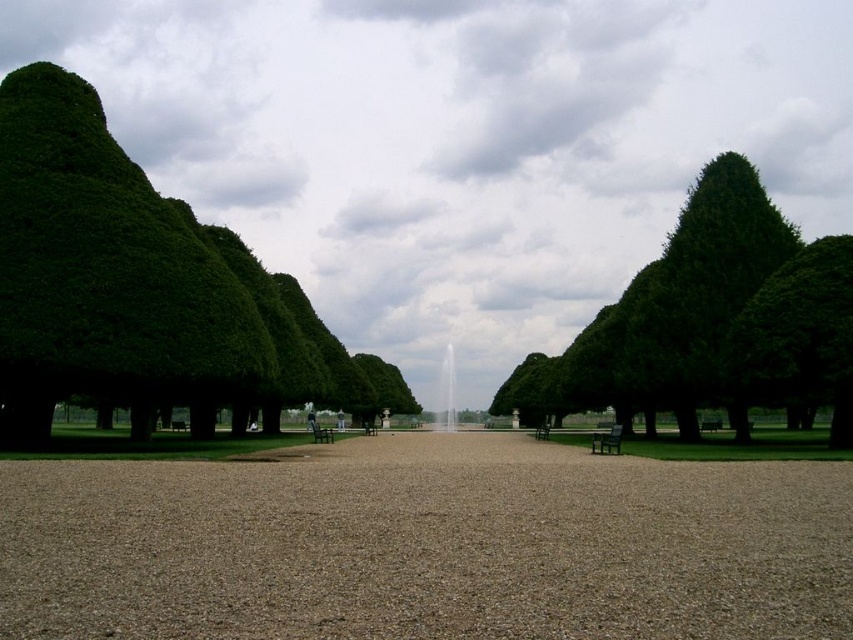
You are a gardener planning to trim both the green leafy tree at left and the green textured tree at right. Based on their sizes, which tree requires more time and effort to maintain?

The green leafy tree at left requires more time and effort to maintain because it is bigger than the green textured tree at right.

Based on the photo, you are standing at the starting point of the garden pathway and want to walk towards the fountain. Is the brown gravel at center located directly in front of you along the path?

The brown gravel at center is located at point coordinates that are slightly off the central path, so it is not directly in front along the path. Therefore, you would need to adjust your direction slightly to reach it.

You are standing at the entrance of the garden pathway and want to walk towards the fountain. As you move forward, will the green textured tree at right become visible behind the brown gravel at center?

The brown gravel at center is in front of the green textured tree at right, so as you walk towards the fountain, the green textured tree at right will become visible behind the brown gravel at center as you move forward.